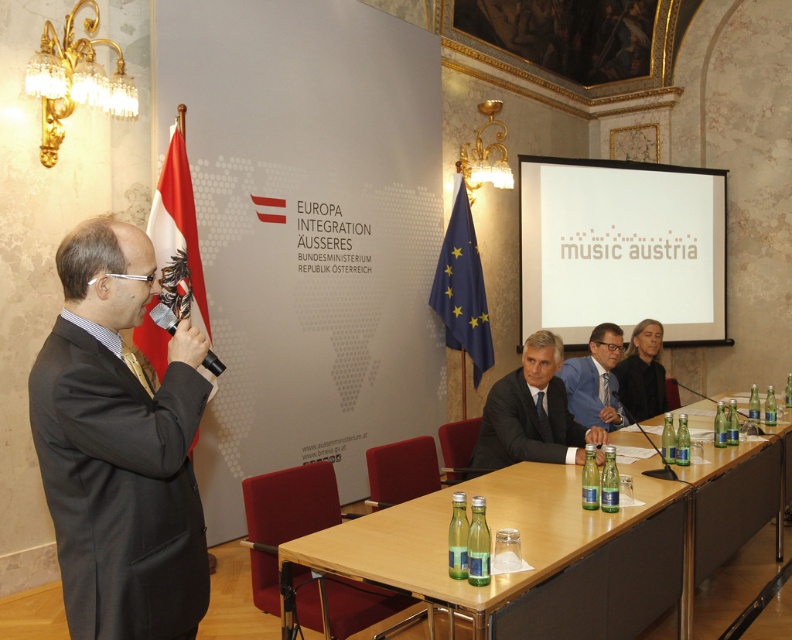
Which is in front, point (528, 538) or point (499, 448)?

Point (528, 538) is in front.

Can you confirm if wooden table at center is positioned to the right of dark blue fabric business suit at center?

Incorrect, wooden table at center is not on the right side of dark blue fabric business suit at center.

Image resolution: width=792 pixels, height=640 pixels. What are the coordinates of `wooden table at center` in the screenshot? It's located at (490, 529).

Find the location of a particular element. wooden table at center is located at coordinates (490, 529).

Does wooden table at center have a larger size compared to black suit at center?

Correct, wooden table at center is larger in size than black suit at center.

Does wooden table at center appear on the right side of black suit at center?

Incorrect, wooden table at center is not on the right side of black suit at center.

Describe the element at coordinates (490, 529) in the screenshot. The height and width of the screenshot is (640, 792). I see `wooden table at center` at that location.

This screenshot has width=792, height=640. Find the location of `wooden table at center`. wooden table at center is located at coordinates (490, 529).

Does black matte suit at left appear over black suit at center?

Incorrect, black matte suit at left is not positioned above black suit at center.

Does black matte suit at left appear on the left side of black suit at center?

Correct, you'll find black matte suit at left to the left of black suit at center.

Which is in front, point (160, 573) or point (661, 376)?

Point (160, 573) is more forward.

Locate an element on the screen. The width and height of the screenshot is (792, 640). black matte suit at left is located at coordinates (120, 486).